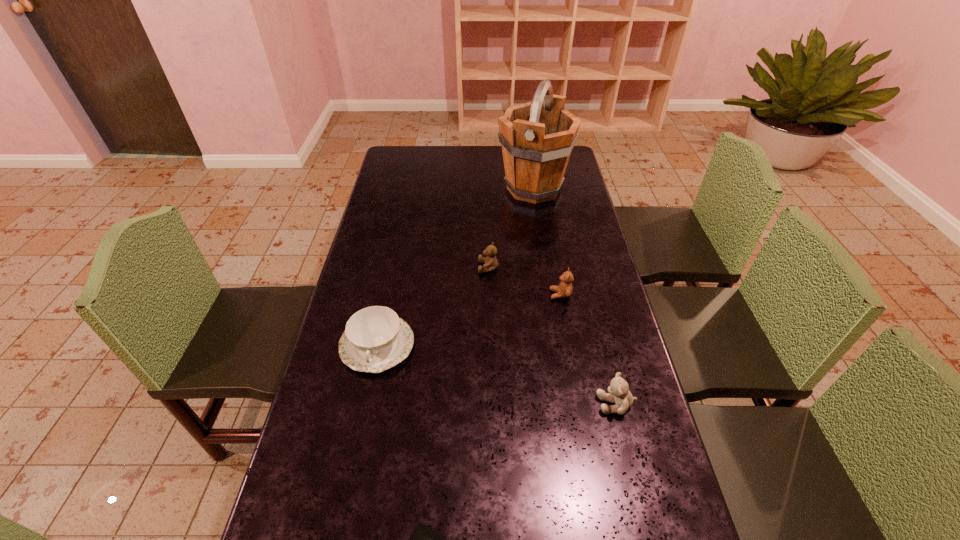
This screenshot has width=960, height=540. Find the location of `vacant space situated on the handle side of the third nearest object`. vacant space situated on the handle side of the third nearest object is located at coordinates (353, 460).

Locate an element on the screen. The image size is (960, 540). object that is positioned at the far edge is located at coordinates (537, 137).

Locate an element on the screen. object located in the left edge section of the desktop is located at coordinates (375, 339).

Locate an element on the screen. bucket that is at the right edge is located at coordinates (537, 137).

Where is `object that is at the far right corner`? This screenshot has width=960, height=540. object that is at the far right corner is located at coordinates tap(537, 137).

Find the location of a particular element. This screenshot has width=960, height=540. vacant space at the left edge is located at coordinates (312, 445).

This screenshot has height=540, width=960. In order to click on blank space at the right edge of the desktop in this screenshot , I will do `click(581, 194)`.

Image resolution: width=960 pixels, height=540 pixels. Identify the location of vacant point at the far left corner. (407, 162).

Identify the location of blank region between the rightmost teddy bear and the second farthest object. (552, 335).

The height and width of the screenshot is (540, 960). I want to click on vacant point located between the second teddy bear from left to right and the leftmost teddy bear, so click(524, 281).